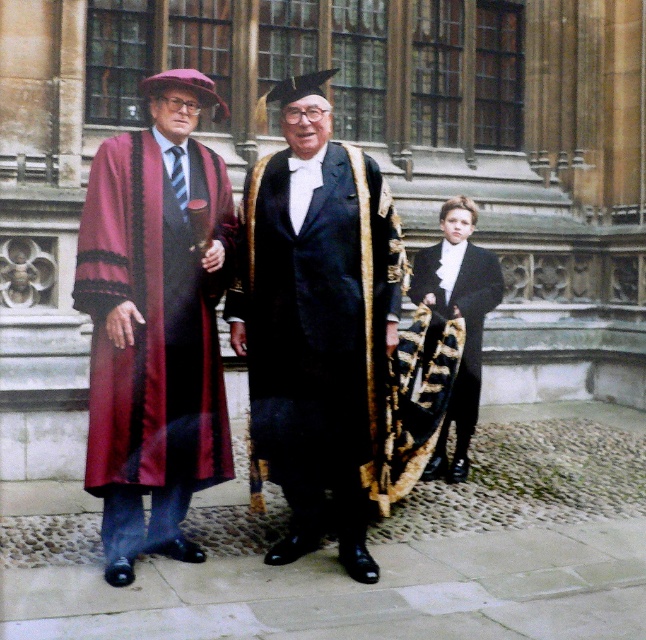
Question: Which point is closer to the camera?

Choices:
 (A) shiny black robe at center
 (B) maroon satin robe at left
 (C) black satin tuxedo at center

Answer: (B)

Question: Can you confirm if shiny black robe at center is positioned to the right of black satin tuxedo at center?

Choices:
 (A) no
 (B) yes

Answer: (A)

Question: Which point is farther from the camera taking this photo?

Choices:
 (A) (120, 396)
 (B) (422, 278)
 (C) (258, 300)

Answer: (B)

Question: Is shiny black robe at center to the left of black satin tuxedo at center from the viewer's perspective?

Choices:
 (A) no
 (B) yes

Answer: (B)

Question: Does maroon satin robe at left appear on the left side of shiny black robe at center?

Choices:
 (A) yes
 (B) no

Answer: (A)

Question: Which point appears farthest from the camera in this image?

Choices:
 (A) (468, 262)
 (B) (271, 163)
 (C) (158, 228)

Answer: (A)